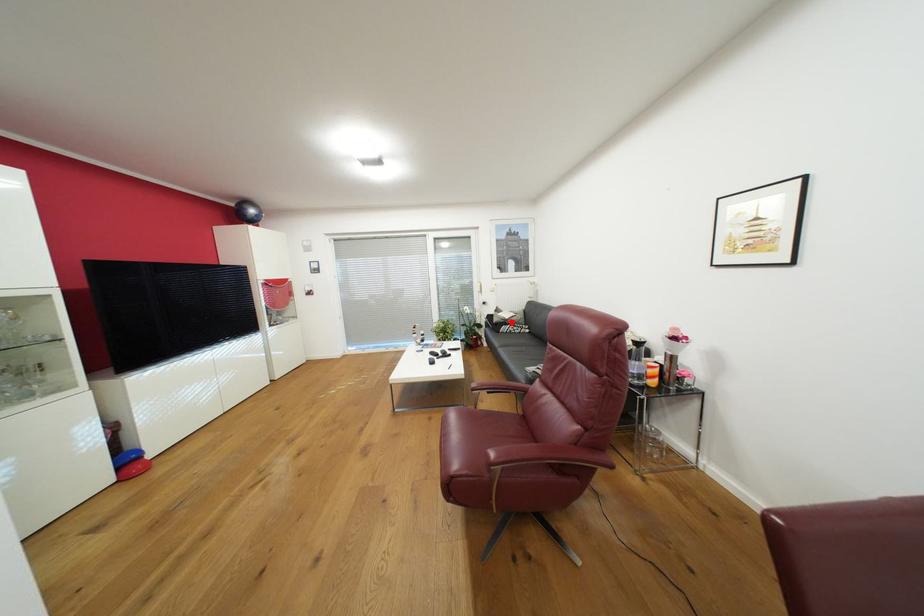
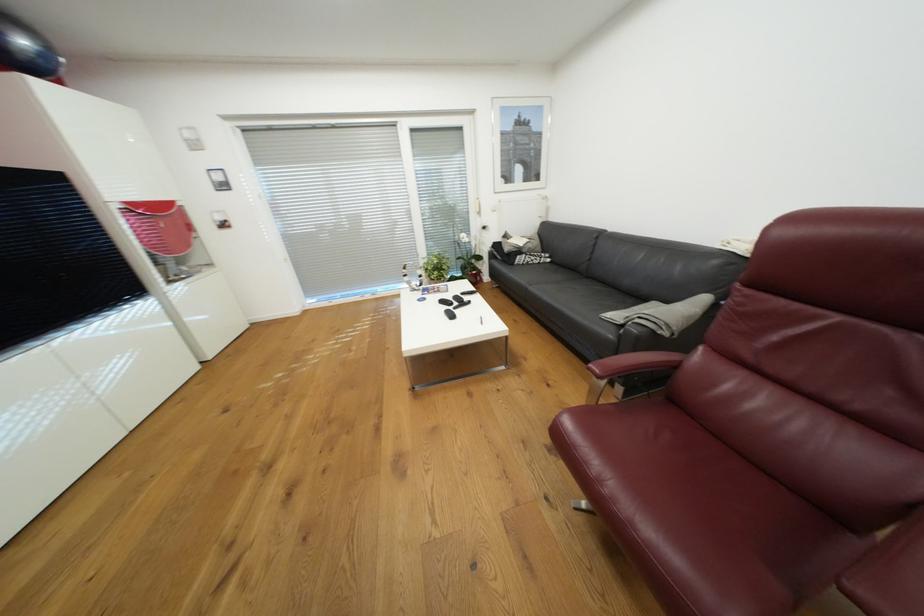
Question: I am providing you with two images of the same scene from different viewpoints. A red point is marked on the first image. At the location where the point appears in image 1, is it still visible in image 2?

Choices:
 (A) Yes
 (B) No

Answer: (A)